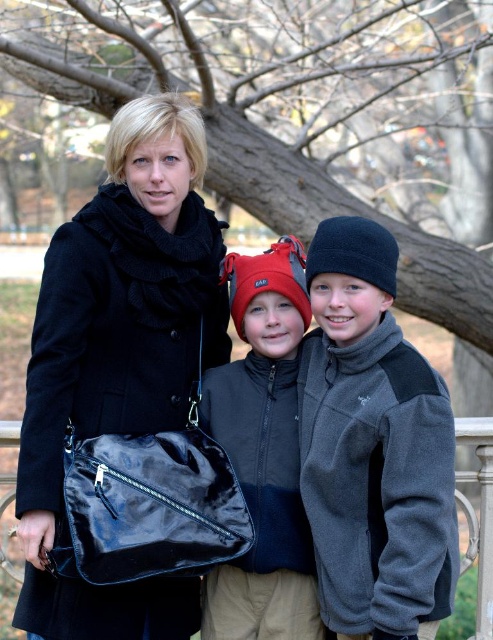
Question: Observing the image, what is the correct spatial positioning of brown bark tree at center in reference to glossy black bag at lower center?

Choices:
 (A) right
 (B) left

Answer: (A)

Question: Among these points, which one is nearest to the camera?

Choices:
 (A) (288, 332)
 (B) (302, 216)
 (C) (348, 572)
 (D) (169, 216)

Answer: (C)

Question: Which point is closer to the camera?

Choices:
 (A) (470, 304)
 (B) (242, 596)
 (C) (327, 412)

Answer: (C)

Question: Is velvet black coat at center behind dark gray fleece jacket at center?

Choices:
 (A) yes
 (B) no

Answer: (A)

Question: Does brown bark tree at center have a lesser width compared to glossy black bag at lower center?

Choices:
 (A) no
 (B) yes

Answer: (A)

Question: Estimate the real-world distances between objects in this image. Which object is closer to the matte black jacket at center?

Choices:
 (A) glossy black bag at lower center
 (B) dark gray fleece jacket at center
 (C) velvet black coat at center

Answer: (B)